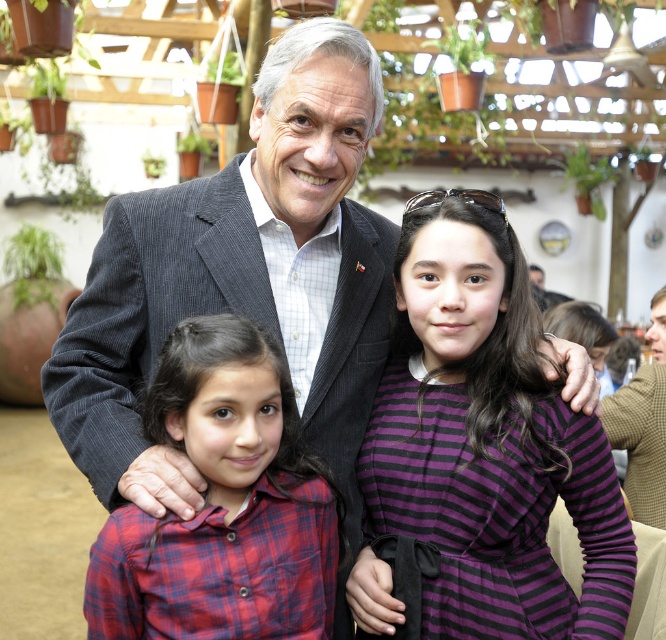
Based on the scene description and the coordinates provided, what does the point at coordinates (240, 276) correspond to in the image?

The point at coordinates (240, 276) corresponds to the dark gray corduroy suit at center.

You are a photographer setting up a photo shoot in the described scene. The photographer wants to ensure that the dark gray corduroy suit at center and the plaid fabric shirt at lower left are clearly visible in the final image. Given that the minimum focus distance for the camera is 9 inches, will both items be in focus?

The dark gray corduroy suit at center is 9.32 inches away from the plaid fabric shirt at lower left. Since the minimum focus distance is 9 inches, the distance between them is sufficient, so both items will be in focus as long as the camera is focused appropriately.

You are standing in the room and want to place a small potted plant exactly where the dark gray corduroy suit at center is located. What are the coordinates where you should place it?

The coordinates for the dark gray corduroy suit at center are 0.434 on the x axis and 0.363 on the y axis, so you should place the potted plant at those coordinates.